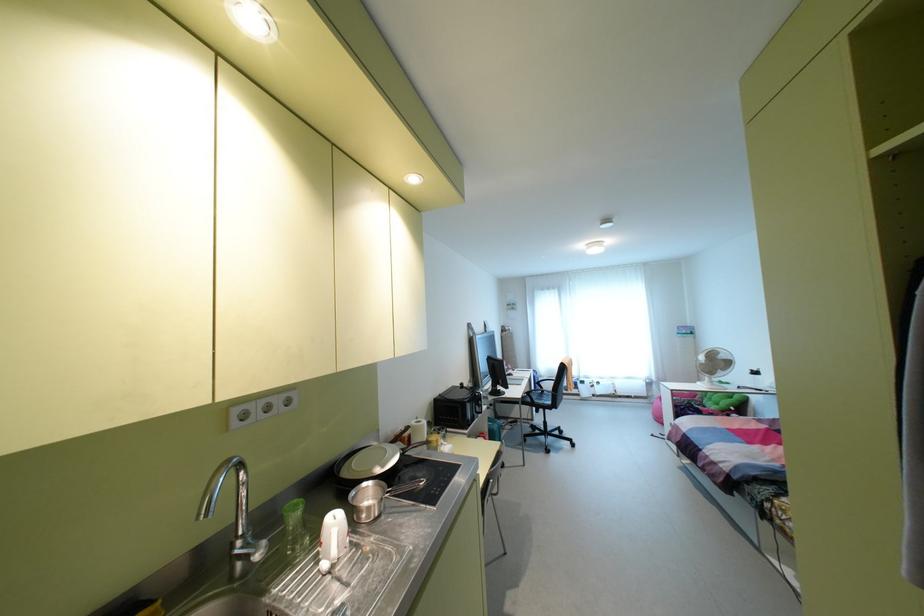
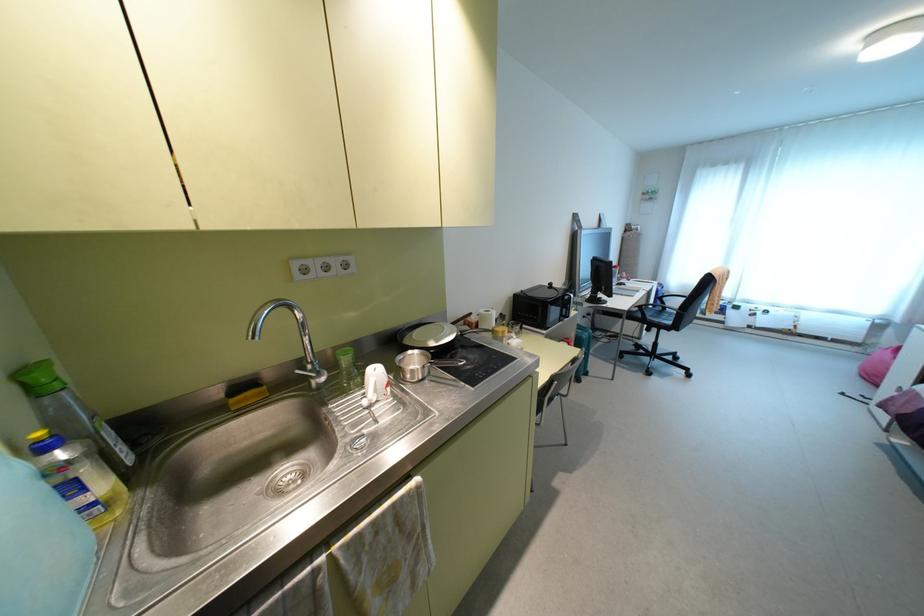
Find the pixel in the second image that matches point 241,535 in the first image.

(310, 362)